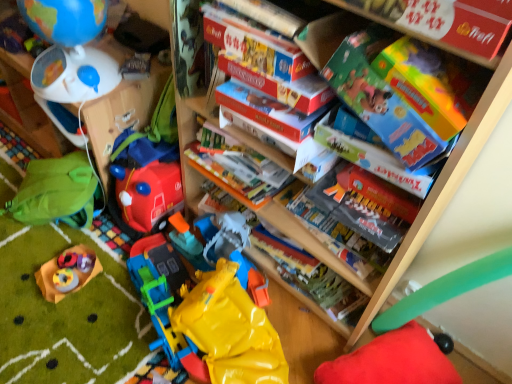
Locate an element on the screen. This screenshot has height=384, width=512. vacant area on top of red plush cushion at lower right, the 1th toy from the right (from a real-world perspective) is located at coordinates (397, 363).